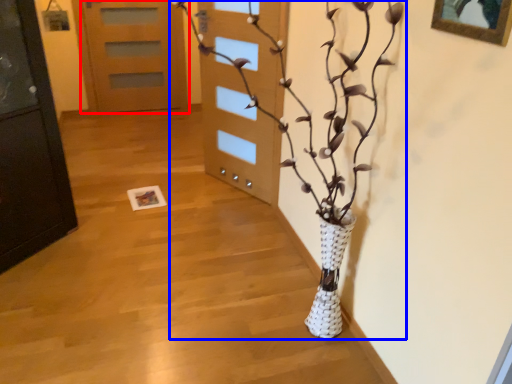
Question: Which object appears closest to the camera in this image, door (highlighted by a red box) or houseplant (highlighted by a blue box)?

Choices:
 (A) door
 (B) houseplant

Answer: (B)